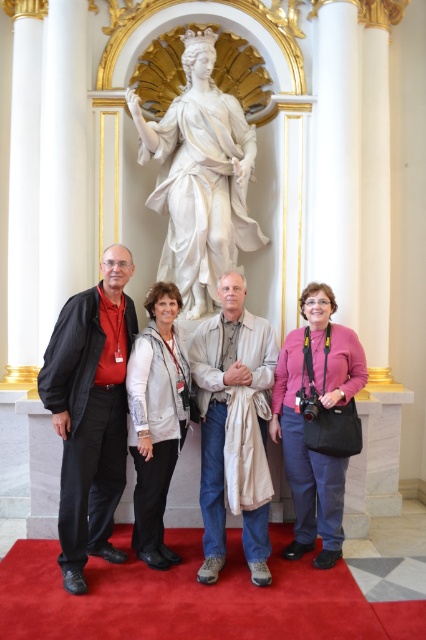
Who is higher up, white marble statue at center or silver metallic jacket at center?

white marble statue at center is higher up.

Does white marble statue at center have a lesser height compared to silver metallic jacket at center?

Incorrect, white marble statue at center's height does not fall short of silver metallic jacket at center's.

Does point (196, 80) come behind point (160, 445)?

Yes, point (196, 80) is farther from viewer.

Locate an element on the screen. This screenshot has height=640, width=426. white marble statue at center is located at coordinates (199, 177).

Is pink fabric purse at center bigger than silver metallic jacket at center?

Yes.

Does pink fabric purse at center appear on the right side of silver metallic jacket at center?

Correct, you'll find pink fabric purse at center to the right of silver metallic jacket at center.

Where is `pink fabric purse at center`? pink fabric purse at center is located at coordinates (304, 422).

Is matte black jacket at left thinner than light beige fabric draped over man at center?

Indeed, matte black jacket at left has a lesser width compared to light beige fabric draped over man at center.

Locate an element on the screen. This screenshot has height=640, width=426. matte black jacket at left is located at coordinates 91,412.